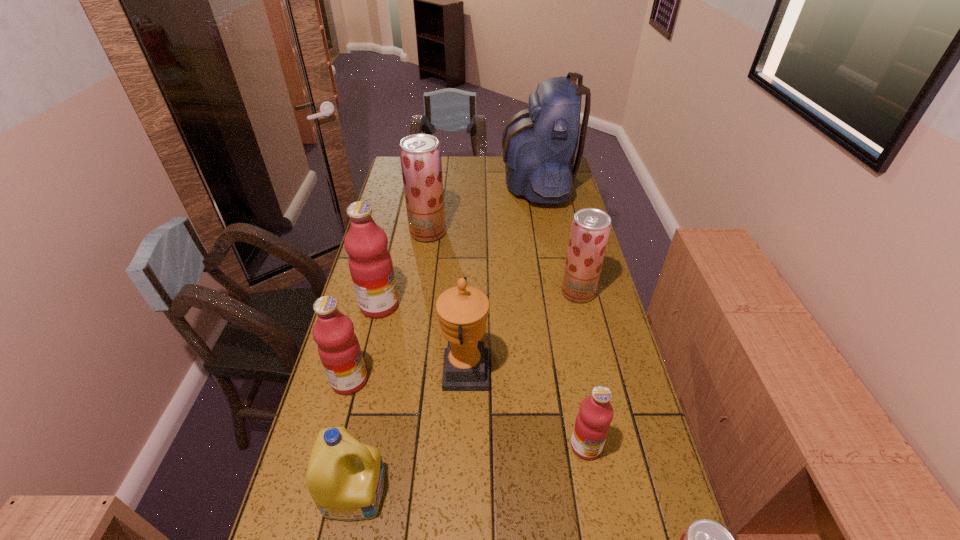
Locate an element on the screen. vacant space located 0.290m on the label of the second farthest pink fruit juice is located at coordinates (473, 380).

Image resolution: width=960 pixels, height=540 pixels. I want to click on vacant space located 0.300m on the label of the eighth farthest object, so click(517, 490).

You are a GUI agent. You are given a task and a screenshot of the screen. Output one action in this format:
    pyautogui.click(x=<x>, y=<y>)
    Task: Click on the free point located 0.150m on the label of the fifth farthest fruit juice
    
    Given the screenshot: What is the action you would take?
    pyautogui.click(x=601, y=531)

Identify the location of object present at the far edge. The width and height of the screenshot is (960, 540). (539, 144).

Where is `detergent situated at the left edge`? This screenshot has width=960, height=540. detergent situated at the left edge is located at coordinates (345, 478).

Locate an element on the screen. backpack situated at the right edge is located at coordinates (539, 144).

Identify the location of object located at the far right corner. The image size is (960, 540). [539, 144].

Where is `free space at the far edge`? This screenshot has height=540, width=960. free space at the far edge is located at coordinates (445, 166).

The width and height of the screenshot is (960, 540). I want to click on vacant space at the left edge of the desktop, so click(x=354, y=292).

You are a GUI agent. You are given a task and a screenshot of the screen. Output one action in this format:
    pyautogui.click(x=<x>, y=<y>)
    Task: Click on the vacant space at the right edge of the desktop
    The height and width of the screenshot is (540, 960).
    Given the screenshot: What is the action you would take?
    pyautogui.click(x=557, y=285)